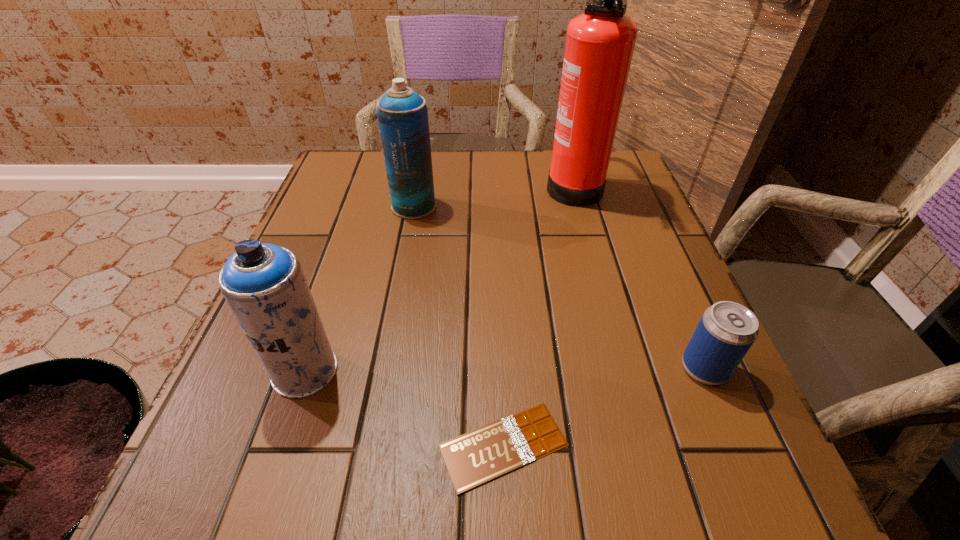
This screenshot has width=960, height=540. Identify the location of the fourth closest object to the third object from left to right. (x=600, y=42).

The width and height of the screenshot is (960, 540). Find the location of `free point that satisfies the following two spatial constraints: 1. at the nozzle of the tallest object; 2. on the right side of the rightmost object`. free point that satisfies the following two spatial constraints: 1. at the nozzle of the tallest object; 2. on the right side of the rightmost object is located at coordinates (624, 368).

The width and height of the screenshot is (960, 540). Find the location of `vacant area that satisfies the following two spatial constraints: 1. at the nozzle of the tallest object; 2. on the front side of the nearest object`. vacant area that satisfies the following two spatial constraints: 1. at the nozzle of the tallest object; 2. on the front side of the nearest object is located at coordinates (646, 446).

Where is `free point that satisfies the following two spatial constraints: 1. at the nozzle of the second object from right to left; 2. on the right side of the rightmost object`? The width and height of the screenshot is (960, 540). free point that satisfies the following two spatial constraints: 1. at the nozzle of the second object from right to left; 2. on the right side of the rightmost object is located at coordinates (624, 368).

The width and height of the screenshot is (960, 540). In order to click on vacant region that satisfies the following two spatial constraints: 1. at the nozzle of the rightmost object; 2. on the right side of the tallest object in this screenshot , I will do `click(624, 368)`.

This screenshot has height=540, width=960. What are the coordinates of `free space in the image that satisfies the following two spatial constraints: 1. on the front side of the left aerosol can; 2. on the left side of the shortest object` in the screenshot? It's located at (279, 446).

Where is `blank space that satisfies the following two spatial constraints: 1. on the back side of the fourth tallest object; 2. on the left side of the left aerosol can`? blank space that satisfies the following two spatial constraints: 1. on the back side of the fourth tallest object; 2. on the left side of the left aerosol can is located at coordinates (305, 368).